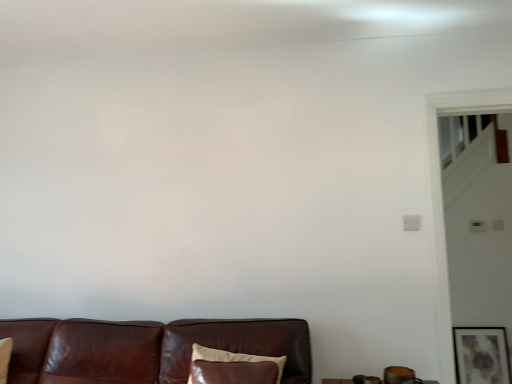
Locate an element on the screen. The height and width of the screenshot is (384, 512). matte gray painting at lower right is located at coordinates (481, 355).

The height and width of the screenshot is (384, 512). What are the coordinates of `matte gray painting at lower right` in the screenshot? It's located at point(481,355).

Is matte gray painting at lower right not within brown leather pillow at lower center?

Yes, matte gray painting at lower right is not within brown leather pillow at lower center.

Is matte gray painting at lower right placed right next to brown leather pillow at lower center?

matte gray painting at lower right and brown leather pillow at lower center are clearly separated.

Does matte gray painting at lower right have a lesser width compared to brown leather pillow at lower center?

Yes.

From the image's perspective, does brown leather couch at lower center appear lower than brown leather pillow at lower center?

Indeed, from the image's perspective, brown leather couch at lower center is shown beneath brown leather pillow at lower center.

The width and height of the screenshot is (512, 384). Identify the location of pillow above the brown leather couch at lower center (from the image's perspective). (233, 367).

In the image, is brown leather couch at lower center on the left side or the right side of brown leather pillow at lower center?

Based on their positions, brown leather couch at lower center is located to the left of brown leather pillow at lower center.

Locate an element on the screen. This screenshot has height=384, width=512. picture frame that appears below the brown leather pillow at lower center (from the image's perspective) is located at coordinates (481, 355).

Considering the sizes of brown leather pillow at lower center and matte gray painting at lower right in the image, is brown leather pillow at lower center wider or thinner than matte gray painting at lower right?

Clearly, brown leather pillow at lower center has more width compared to matte gray painting at lower right.

Is brown leather pillow at lower center bigger than matte gray painting at lower right?

Indeed, brown leather pillow at lower center has a larger size compared to matte gray painting at lower right.

From a real-world perspective, which object stands above the other?

In real-world perspective, brown leather couch at lower center is above.

In the image, is brown leather couch at lower center on the left side or the right side of matte gray painting at lower right?

In the image, brown leather couch at lower center appears on the left side of matte gray painting at lower right.

Is brown leather couch at lower center far away from matte gray painting at lower right?

Yes, brown leather couch at lower center is far from matte gray painting at lower right.

Is matte gray painting at lower right turned away from brown leather couch at lower center?

matte gray painting at lower right does not have its back to brown leather couch at lower center.

Between matte gray painting at lower right and brown leather couch at lower center, which one has smaller width?

With smaller width is matte gray painting at lower right.

Does matte gray painting at lower right have a larger size compared to brown leather couch at lower center?

No.

Is point (476, 356) less distant than point (149, 381)?

No, it is behind (149, 381).

Which object is positioned more to the left, brown leather pillow at lower center or brown leather couch at lower center?

brown leather couch at lower center is more to the left.

Considering the positions of points (190, 372) and (29, 381), is point (190, 372) closer to camera compared to point (29, 381)?

Yes, it is in front of point (29, 381).

What's the angular difference between brown leather pillow at lower center and brown leather couch at lower center's facing directions?

brown leather pillow at lower center and brown leather couch at lower center are facing 3.5 degrees away from each other.

Is the surface of brown leather pillow at lower center in direct contact with brown leather couch at lower center?

No.

You are a GUI agent. You are given a task and a screenshot of the screen. Output one action in this format:
    pyautogui.click(x=<x>, y=<y>)
    Task: Click on the pillow on the left side of matte gray painting at lower right
    Image resolution: width=512 pixels, height=384 pixels.
    Given the screenshot: What is the action you would take?
    pyautogui.click(x=233, y=367)

Find the location of a particular element. This screenshot has width=512, height=384. pillow above the brown leather couch at lower center (from a real-world perspective) is located at coordinates (233, 367).

In the scene shown: Looking at the image, which one is located further to matte gray painting at lower right, brown leather pillow at lower center or brown leather couch at lower center?

brown leather pillow at lower center.

Which object lies further to the anchor point matte gray painting at lower right, brown leather couch at lower center or brown leather pillow at lower center?

Based on the image, brown leather pillow at lower center appears to be further to matte gray painting at lower right.

Which object lies nearer to the anchor point brown leather couch at lower center, brown leather pillow at lower center or matte gray painting at lower right?

brown leather pillow at lower center is closer to brown leather couch at lower center.

Estimate the real-world distances between objects in this image. Which object is closer to brown leather pillow at lower center, matte gray painting at lower right or brown leather couch at lower center?

brown leather couch at lower center is closer to brown leather pillow at lower center.

Based on their spatial positions, is brown leather couch at lower center or matte gray painting at lower right closer to brown leather pillow at lower center?

Among the two, brown leather couch at lower center is located nearer to brown leather pillow at lower center.

Estimate the real-world distances between objects in this image. Which object is closer to brown leather couch at lower center, matte gray painting at lower right or brown leather pillow at lower center?

brown leather pillow at lower center is positioned closer to the anchor brown leather couch at lower center.

Locate an element on the screen. pillow between brown leather couch at lower center and matte gray painting at lower right is located at coordinates (233, 367).